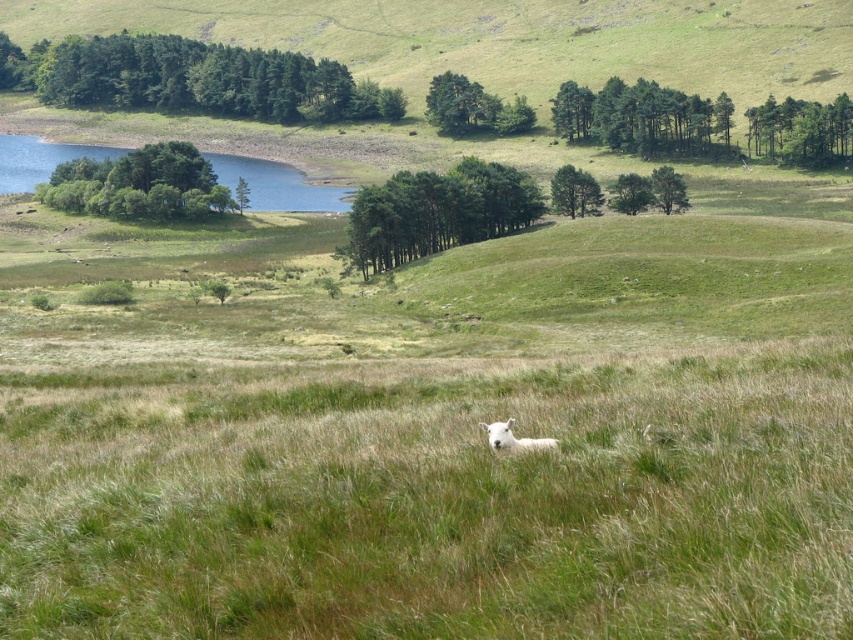
Question: Which object appears closest to the camera in this image?

Choices:
 (A) green grassy hillside at upper center
 (B) green matte trees at upper right
 (C) green matte tree at center

Answer: (C)

Question: Can you confirm if green matte trees at upper left is positioned below white woolly sheep at center?

Choices:
 (A) yes
 (B) no

Answer: (B)

Question: Does green grassy hillside at upper center have a greater width compared to green matte tree at center?

Choices:
 (A) no
 (B) yes

Answer: (B)

Question: Which object appears closest to the camera in this image?

Choices:
 (A) white woolly sheep at center
 (B) green matte trees at upper right
 (C) green leafy trees at left

Answer: (A)

Question: Does green matte trees at upper left appear on the left side of green leafy trees at center?

Choices:
 (A) no
 (B) yes

Answer: (B)

Question: Which point appears closest to the camera in this image?

Choices:
 (A) (47, 204)
 (B) (606, 131)
 (C) (566, 209)
 (D) (498, 204)

Answer: (D)